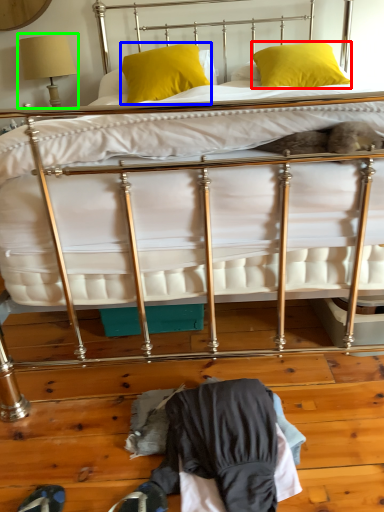
Question: Which is farther away from pillow (highlighted by a red box)? pillow (highlighted by a blue box) or table lamp (highlighted by a green box)?

Choices:
 (A) pillow
 (B) table lamp

Answer: (B)